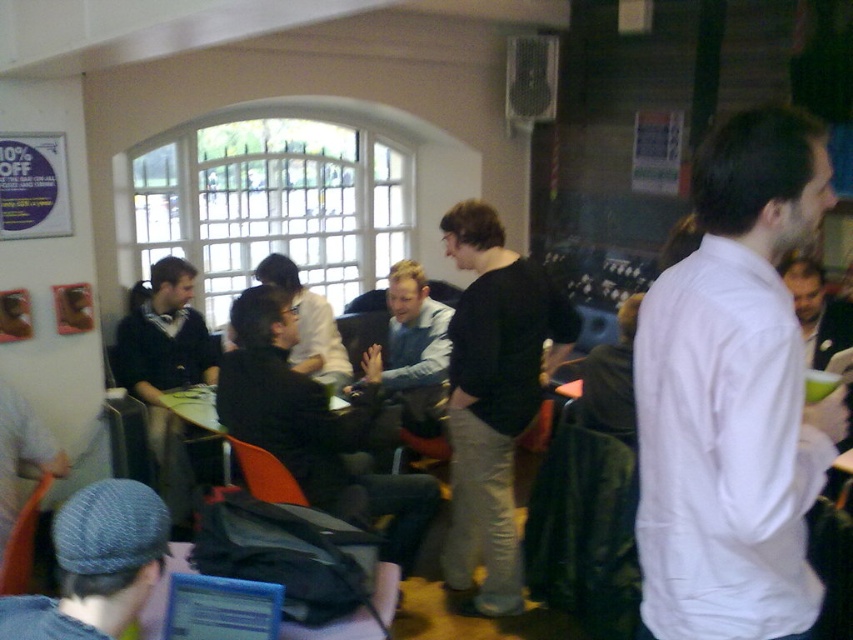
Question: From the image, what is the correct spatial relationship of white smooth shirt at right in relation to blue plastic laptop at lower center?

Choices:
 (A) left
 (B) right

Answer: (B)

Question: Which object is closer to the camera taking this photo?

Choices:
 (A) dark gray sweater at center
 (B) black matte shirt at center
 (C) orange plastic chair at lower left
 (D) matte black jacket at left

Answer: (C)

Question: Can you confirm if denim cap at lower left is bigger than blue plastic laptop at lower center?

Choices:
 (A) no
 (B) yes

Answer: (B)

Question: In this image, where is denim cap at lower left located relative to matte black jacket at left?

Choices:
 (A) right
 (B) left

Answer: (A)

Question: Which point is closer to the camera taking this photo?

Choices:
 (A) (83, 596)
 (B) (500, 580)

Answer: (A)

Question: Which point is closer to the camera?

Choices:
 (A) (6, 582)
 (B) (630, 355)
 (C) (769, 218)
 (D) (183, 500)

Answer: (C)